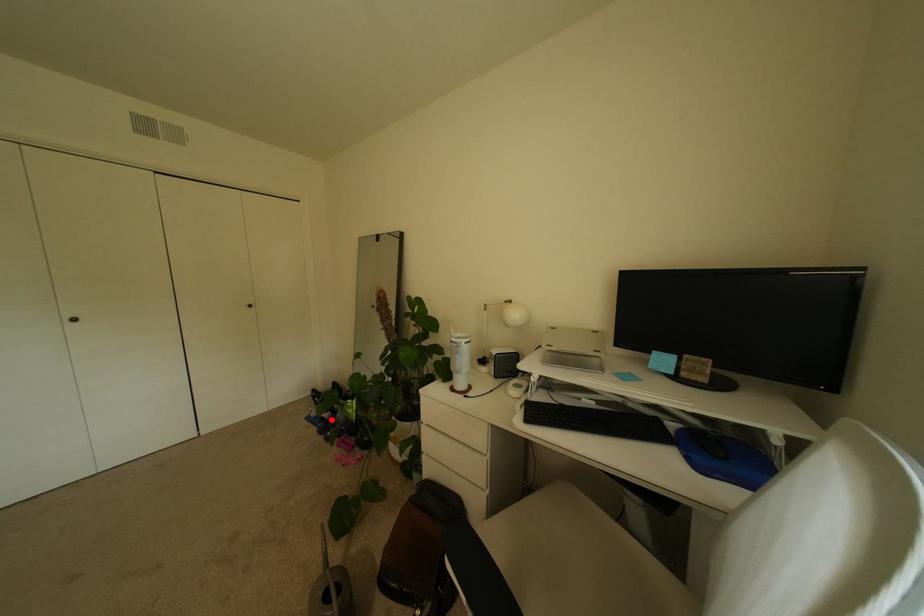
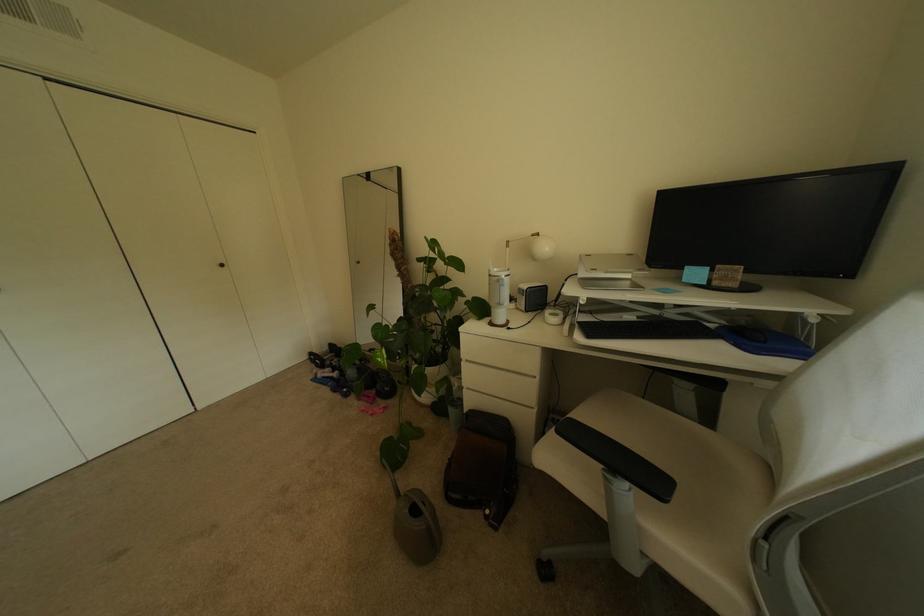
Question: A red point is marked in image1. In image2, is the corresponding 3D point closer to the camera or farther? Reply with the corresponding letter.

Choices:
 (A) The corresponding 3D point is closer.
 (B) The corresponding 3D point is farther.

Answer: (A)